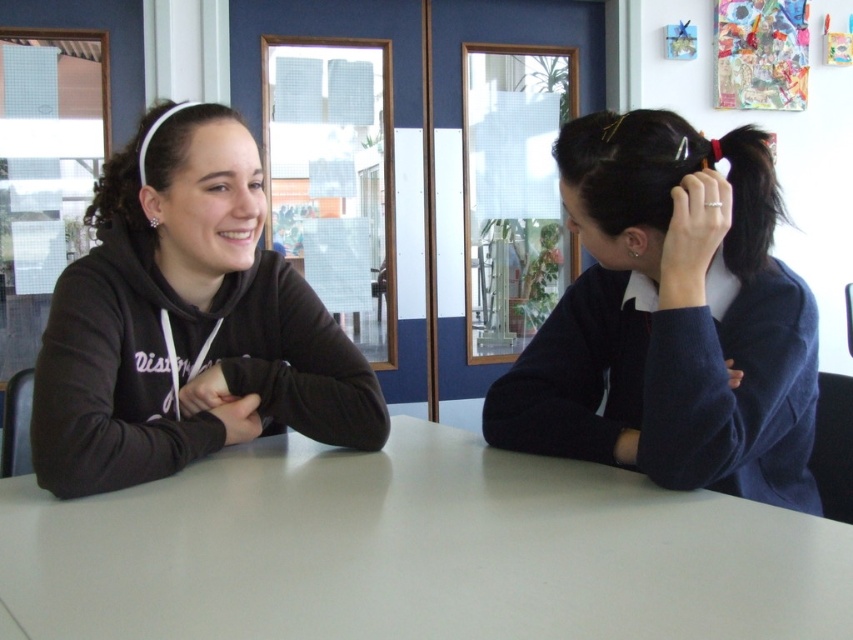
Question: Is white glossy table at center positioned at the back of dark blue sweater at right?

Choices:
 (A) yes
 (B) no

Answer: (B)

Question: Which object is farther from the camera taking this photo?

Choices:
 (A) white glossy table at center
 (B) matte black hoodie at left
 (C) dark blue sweater at right

Answer: (B)

Question: Which of the following is the closest to the observer?

Choices:
 (A) dark blue sweater at right
 (B) white glossy table at center

Answer: (B)

Question: Is white glossy table at center below matte black hoodie at left?

Choices:
 (A) no
 (B) yes

Answer: (B)

Question: Observing the image, what is the correct spatial positioning of dark blue sweater at right in reference to matte black hoodie at left?

Choices:
 (A) above
 (B) below

Answer: (B)

Question: Which point is farther to the camera?

Choices:
 (A) (461, 490)
 (B) (200, 365)
 (C) (621, 465)

Answer: (B)